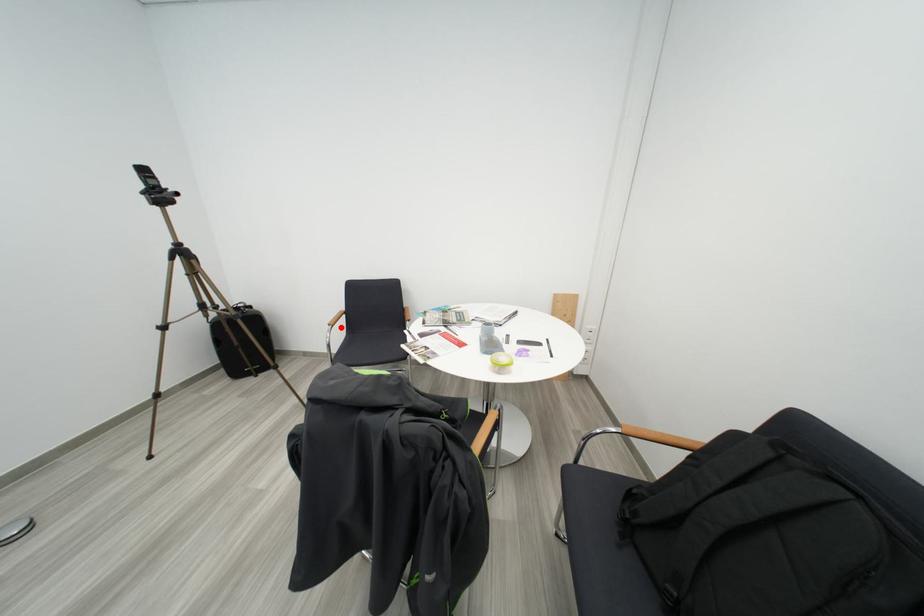
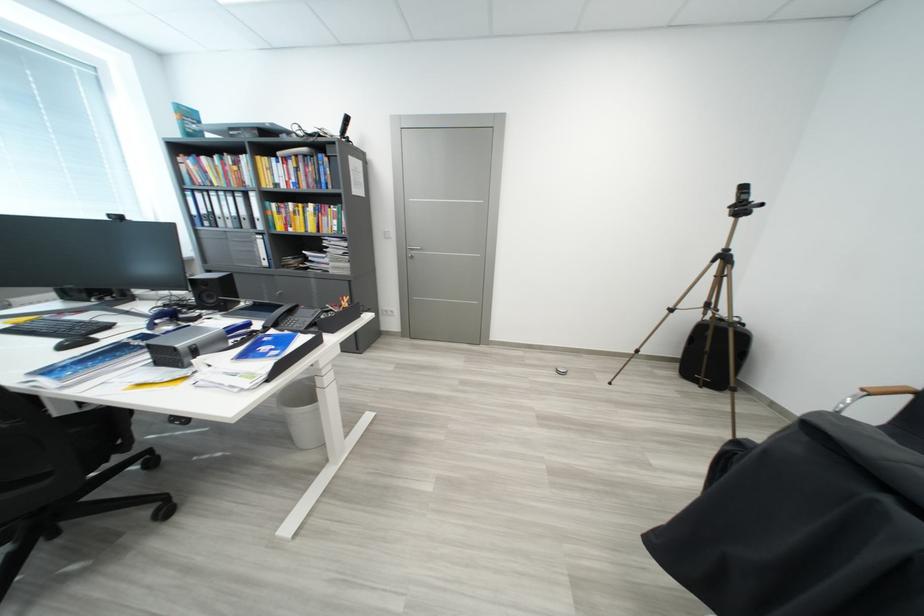
Locate, in the second image, the point that corresponds to the highlighted location in the first image.

(879, 395)